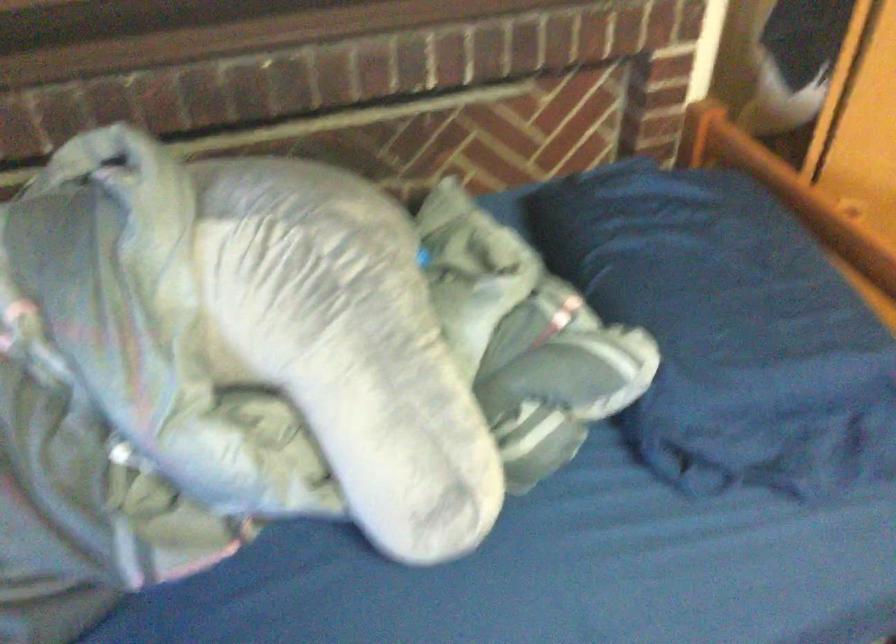
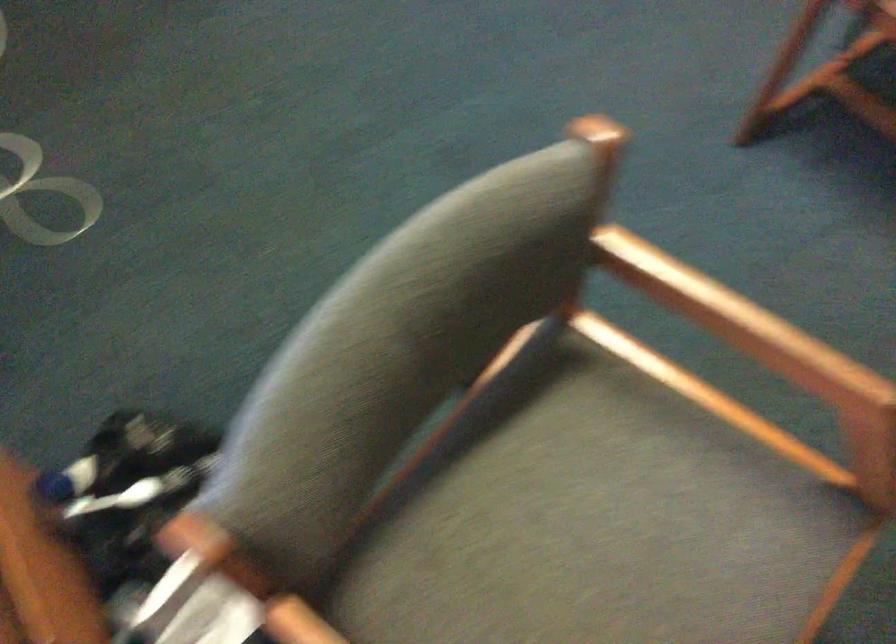
In a continuous first-person perspective shot, in which direction is the camera moving?

The cameraman walked toward right, backward.